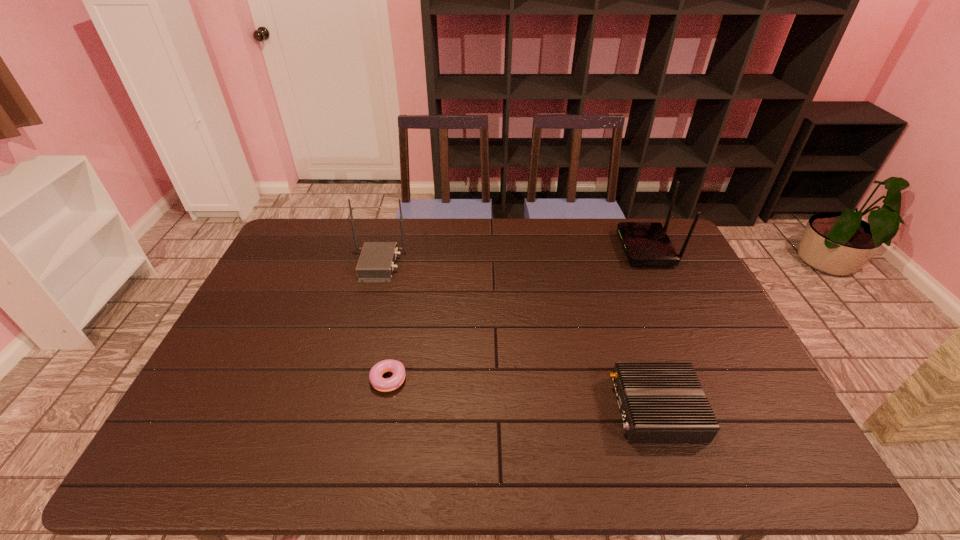
The height and width of the screenshot is (540, 960). Identify the location of vacant space that is in between the leftmost router and the third tallest object. (517, 337).

Identify the location of object that is the second nearest to the shortest router. (396, 367).

Choose which object is the third nearest neighbor to the shortest router. Please provide its 2D coordinates. Your answer should be formatted as a tuple, i.e. [(x, y)], where the tuple contains the x and y coordinates of a point satisfying the conditions above.

[(376, 263)]

Locate which router ranks in proximity to the nearest router. Please provide its 2D coordinates. Your answer should be formatted as a tuple, i.e. [(x, y)], where the tuple contains the x and y coordinates of a point satisfying the conditions above.

[(645, 243)]

Locate which router is the closest to the leftmost router. Please provide its 2D coordinates. Your answer should be formatted as a tuple, i.e. [(x, y)], where the tuple contains the x and y coordinates of a point satisfying the conditions above.

[(660, 402)]

Where is `free spot that satisfies the following two spatial constraints: 1. on the back side of the shortest object; 2. on the back of the leftmost router to connect cables`? The width and height of the screenshot is (960, 540). free spot that satisfies the following two spatial constraints: 1. on the back side of the shortest object; 2. on the back of the leftmost router to connect cables is located at coordinates (410, 265).

Where is `free space that satisfies the following two spatial constraints: 1. on the back side of the doughnut; 2. on the back of the leftmost router to connect cables`? free space that satisfies the following two spatial constraints: 1. on the back side of the doughnut; 2. on the back of the leftmost router to connect cables is located at coordinates coord(410,265).

Where is `free space that satisfies the following two spatial constraints: 1. on the back of the leftmost router to connect cables; 2. on the right side of the shortest object`? The height and width of the screenshot is (540, 960). free space that satisfies the following two spatial constraints: 1. on the back of the leftmost router to connect cables; 2. on the right side of the shortest object is located at coordinates (347, 383).

You are a GUI agent. You are given a task and a screenshot of the screen. Output one action in this format:
    pyautogui.click(x=<x>, y=<y>)
    Task: Click on the vacant position in the image that satisfies the following two spatial constraints: 1. on the back of the leftmost router to connect cables; 2. on the right side of the doughnut
    This screenshot has height=540, width=960.
    Given the screenshot: What is the action you would take?
    pyautogui.click(x=347, y=383)

At what (x,y) coordinates should I click in order to perform the action: click on blank space that satisfies the following two spatial constraints: 1. on the back of the leftmost router to connect cables; 2. on the left side of the shortest object. Please return your answer as a coordinate pair (x, y). The image size is (960, 540). Looking at the image, I should click on (347, 383).